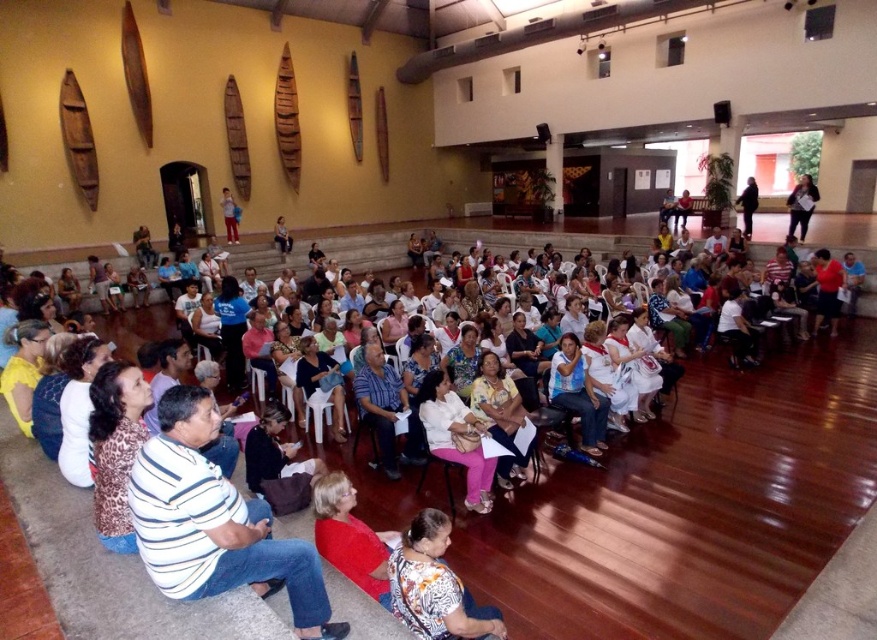
Question: Estimate the real-world distances between objects in this image. Which object is farther from the white cotton shirt at center?

Choices:
 (A) striped shirt at center
 (B) blue fabric chair at center
 (C) white fabric dress at center

Answer: (B)

Question: Which of the following is the farthest from the observer?

Choices:
 (A) (555, 356)
 (B) (433, 436)
 (C) (195, 397)
 (D) (511, 422)

Answer: (A)

Question: In this image, where is striped cotton shirt at center located relative to floral print blouse at center?

Choices:
 (A) right
 (B) left

Answer: (B)

Question: Does striped cotton shirt at center have a greater width compared to white fabric dress at center?

Choices:
 (A) yes
 (B) no

Answer: (A)

Question: Which object is positioned farthest from the striped cotton shirt at center?

Choices:
 (A) white fabric dress at center
 (B) blue fabric chair at center
 (C) striped shirt at center
 (D) floral print blouse at center

Answer: (B)

Question: Does white fabric dress at center come in front of white cotton shirt at center?

Choices:
 (A) yes
 (B) no

Answer: (A)